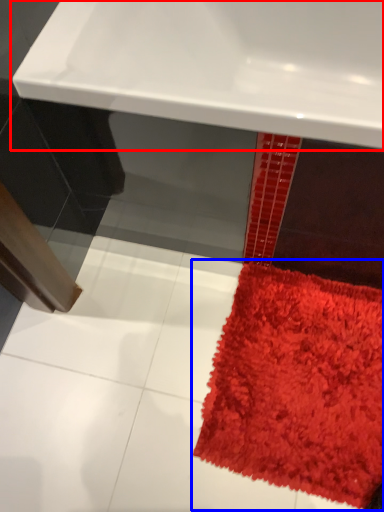
Question: Which object is further to the camera taking this photo, sink (highlighted by a red box) or mat (highlighted by a blue box)?

Choices:
 (A) sink
 (B) mat

Answer: (B)